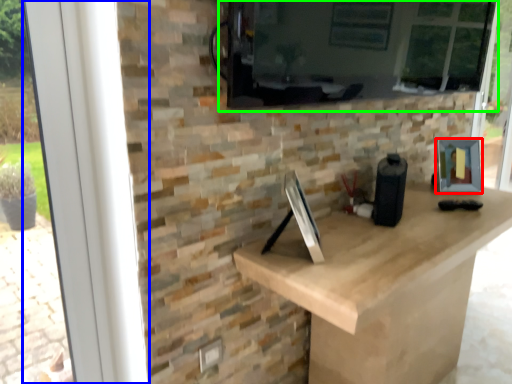
Question: Which object is the farthest from picture frame (highlighted by a red box)? Choose among these: window frame (highlighted by a blue box) or window screen (highlighted by a green box).

Choices:
 (A) window frame
 (B) window screen

Answer: (A)